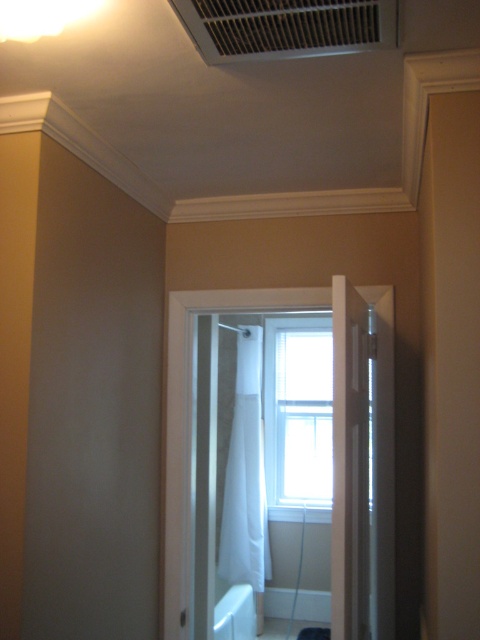
Question: Among these objects, which one is nearest to the camera?

Choices:
 (A) white sheer fabric at center
 (B) white fabric shower curtain at center

Answer: (A)

Question: Which point is closer to the camera taking this photo?

Choices:
 (A) (275, 403)
 (B) (239, 604)
 (C) (358, 44)
 (D) (224, 509)

Answer: (C)

Question: Is clear glass window at center wider than white matte bathtub at lower center?

Choices:
 (A) yes
 (B) no

Answer: (A)

Question: Which point appears farthest from the camera in this image?

Choices:
 (A) (303, 358)
 (B) (220, 324)
 (C) (226, 1)

Answer: (A)

Question: Does white plastic air conditioner at upper center have a larger size compared to white fabric shower curtain at center?

Choices:
 (A) no
 (B) yes

Answer: (A)

Question: Observing the image, what is the correct spatial positioning of white matte bathtub at lower center in reference to white fabric shower curtain at center?

Choices:
 (A) below
 (B) above

Answer: (A)